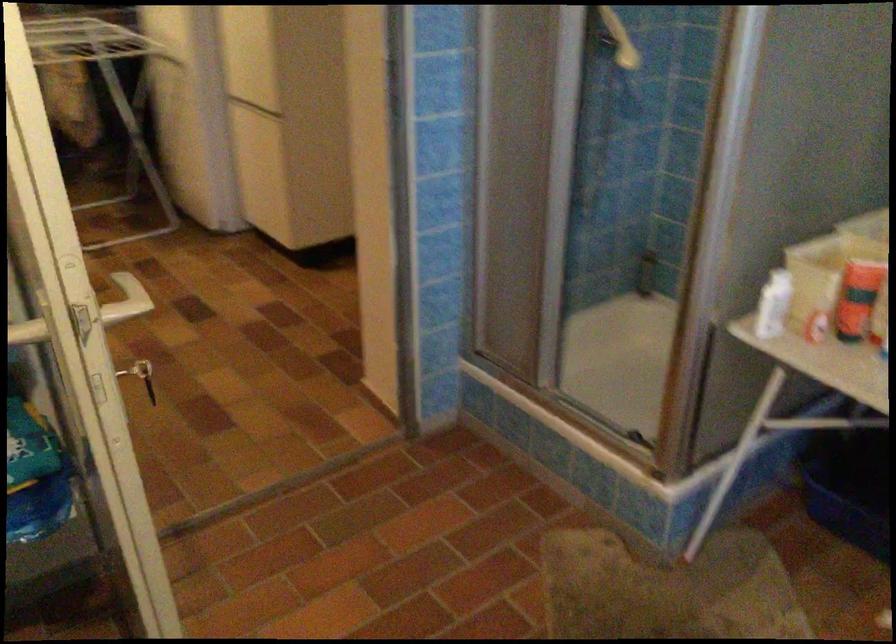
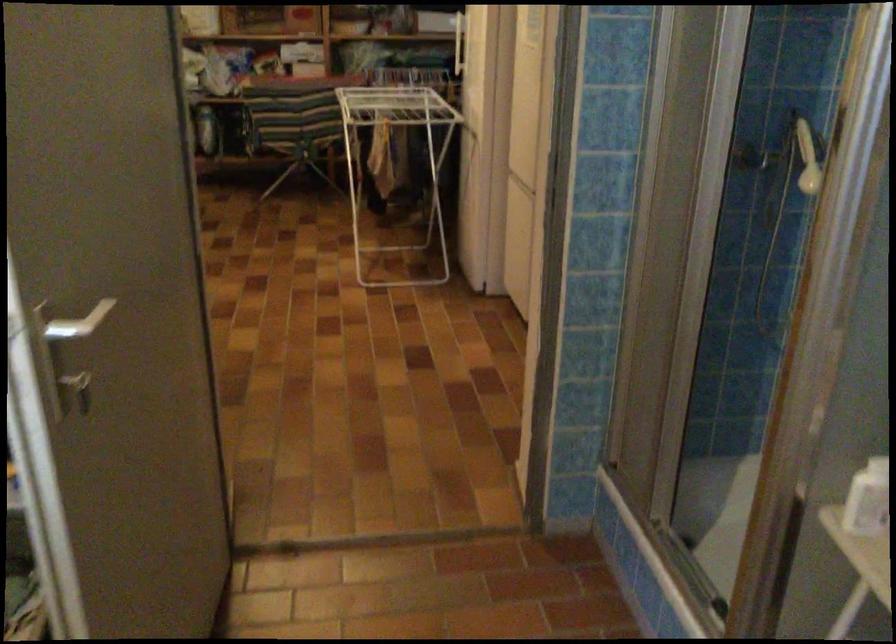
Question: Which direction would the cameraman need to move to produce the second image? Reply with the corresponding letter.

Choices:
 (A) Left
 (B) Right
 (C) Forward
 (D) Backward

Answer: (B)